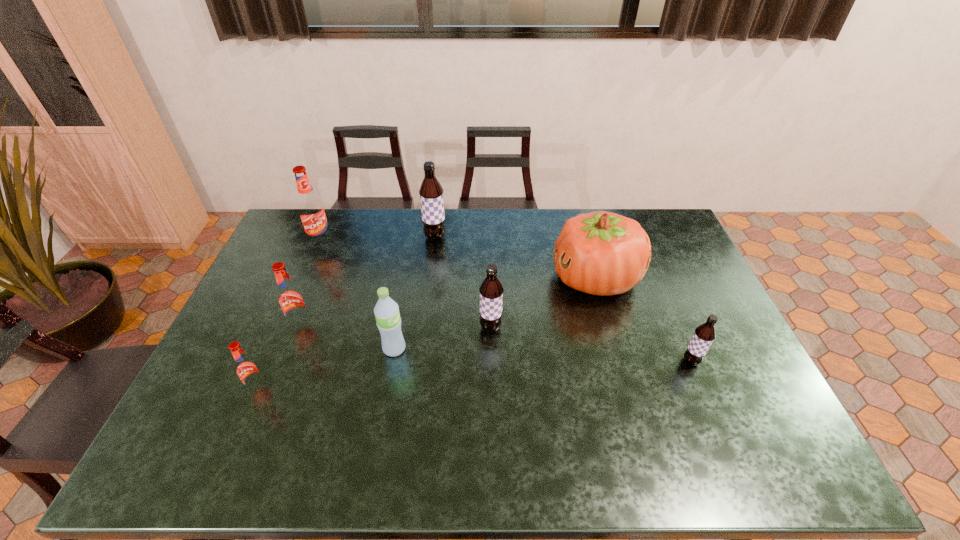
The image size is (960, 540). In order to click on vacant space situated on the front of the second nearest red root beer in this screenshot , I will do `click(246, 472)`.

The height and width of the screenshot is (540, 960). Find the location of `free spot located 0.150m on the left of the water bottle`. free spot located 0.150m on the left of the water bottle is located at coordinates (329, 349).

This screenshot has height=540, width=960. What are the coordinates of `free space located on the right of the fifth farthest root beer` in the screenshot? It's located at (732, 361).

Where is `vacant space located on the right of the nearest object`? The image size is (960, 540). vacant space located on the right of the nearest object is located at coordinates (310, 388).

This screenshot has width=960, height=540. Find the location of `object located in the right edge section of the desktop`. object located in the right edge section of the desktop is located at coordinates (704, 334).

Where is `object that is at the far left corner`? The height and width of the screenshot is (540, 960). object that is at the far left corner is located at coordinates (311, 210).

Identify the location of free space at the far edge. (551, 230).

Where is `free space at the near edge of the desktop`? This screenshot has width=960, height=540. free space at the near edge of the desktop is located at coordinates (321, 436).

This screenshot has height=540, width=960. Identify the location of free point at the left edge. (242, 422).

In the image, there is a desktop. At what (x,y) coordinates should I click in order to perform the action: click on vacant area at the right edge. Please return your answer as a coordinate pair (x, y). This screenshot has width=960, height=540. Looking at the image, I should click on (700, 301).